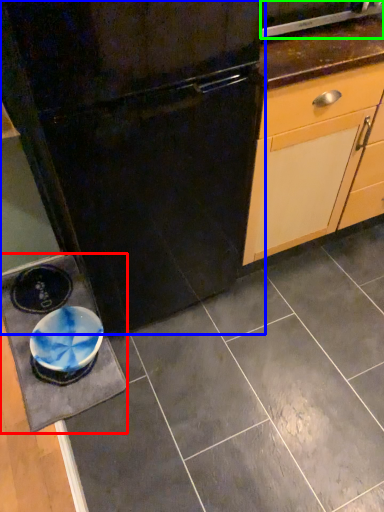
Question: Which object is positioned closest to slate (highlighted by a red box)? Select from refrigerator (highlighted by a blue box) and home appliance (highlighted by a green box).

Choices:
 (A) refrigerator
 (B) home appliance

Answer: (A)